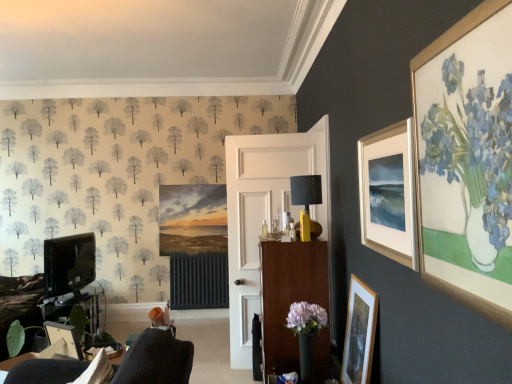
Question: Considering the positions of point 53,256 and point 309,185, is point 53,256 closer or farther from the camera than point 309,185?

Choices:
 (A) farther
 (B) closer

Answer: (A)

Question: In the image, is matte black tv at left on the left side or the right side of yellow matte lampshade at center?

Choices:
 (A) right
 (B) left

Answer: (B)

Question: Which object is positioned closest to the wooden picture frame at lower left, which ranks as the 2th picture frame in bottom-to-top order?

Choices:
 (A) wooden cabinet at center
 (B) brown wood cabinet at center
 (C) yellow matte lampshade at center
 (D) matte black tv at left
 (E) matte black picture frame at lower right, placed as the second picture frame when sorted from right to left

Answer: (B)

Question: Which object is positioned closest to the wooden picture frame at lower left, the 3th picture frame positioned from the right?

Choices:
 (A) brown wood cabinet at center
 (B) matte black tv at left
 (C) matte black picture frame at lower right, marked as the 3th picture frame in a top-to-bottom arrangement
 (D) wooden cabinet at center
 (E) matte white picture frame at upper right, the 3th picture frame ordered from the bottom

Answer: (A)